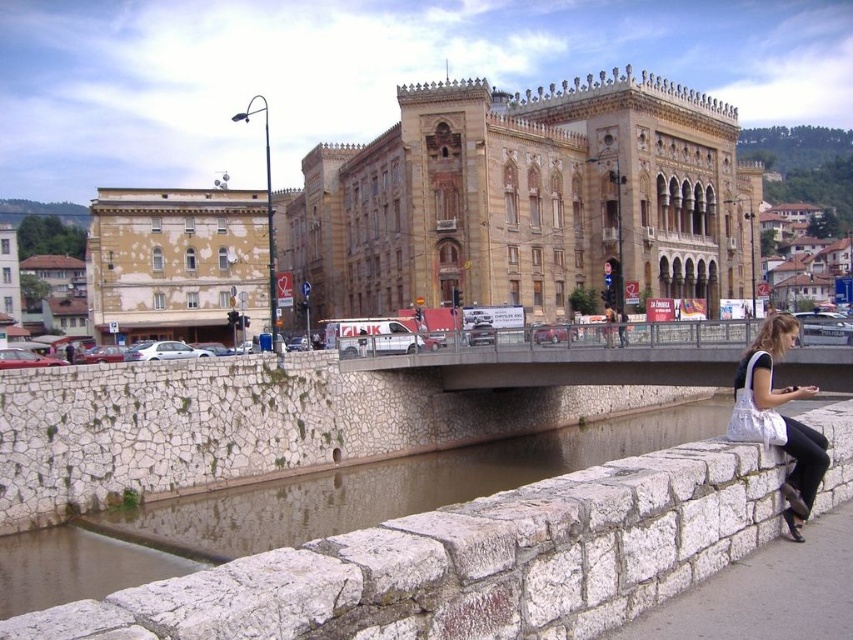
Who is more distant from viewer, (560, 376) or (762, 330)?

Point (560, 376)

Is concrete bridge at center wider than white fabric bag at lower right?

Indeed, concrete bridge at center has a greater width compared to white fabric bag at lower right.

What do you see at coordinates (583, 360) in the screenshot? The height and width of the screenshot is (640, 853). I see `concrete bridge at center` at bounding box center [583, 360].

I want to click on concrete bridge at center, so click(x=583, y=360).

Who is positioned more to the right, yellowish beige stone building at left or white fabric bag at lower right?

Positioned to the right is white fabric bag at lower right.

Does yellowish beige stone building at left have a greater width compared to white fabric bag at lower right?

Yes.

Identify the location of yellowish beige stone building at left. The width and height of the screenshot is (853, 640). (177, 262).

What are the coordinates of `yellowish beige stone building at left` in the screenshot? It's located at (177, 262).

Is yellowish beige stone building at left closer to the viewer compared to concrete bridge at center?

No, yellowish beige stone building at left is behind concrete bridge at center.

Does yellowish beige stone building at left appear on the right side of concrete bridge at center?

Incorrect, yellowish beige stone building at left is not on the right side of concrete bridge at center.

Between point (161, 339) and point (663, 353), which one is positioned in front?

Point (663, 353) is in front.

You are a GUI agent. You are given a task and a screenshot of the screen. Output one action in this format:
    pyautogui.click(x=<x>, y=<y>)
    Task: Click on the yellowish beige stone building at left
    This screenshot has height=640, width=853.
    Given the screenshot: What is the action you would take?
    pyautogui.click(x=177, y=262)